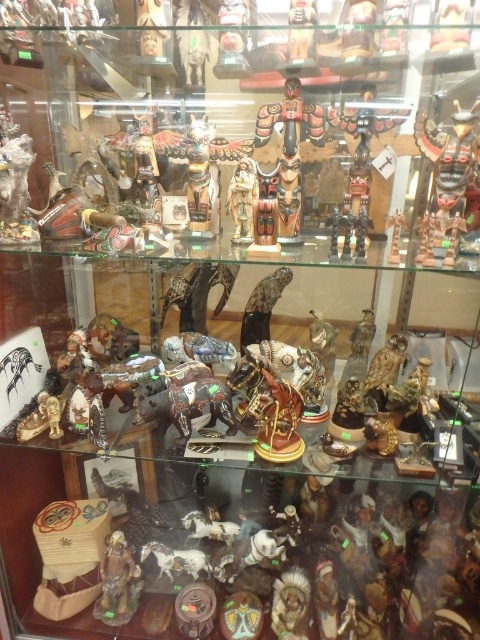
You are looking at the glass case with wooden figurines. There are two points marked in the image, point 1 at coordinates (239, 3) and point 2 at coordinates (291, 10). Which point is closer to you?

Point 1 at coordinates (239, 3) is closer to you because it is further to the camera than point 2 at coordinates (291, 10).

Looking at this image, you are an art curator examining the glass case. You need to determine which object is taller between the matte brown figurine at lower center and the wooden totem pole at center. Based on the scene, which one is taller?

The matte brown figurine at lower center is taller than the wooden totem pole at center.